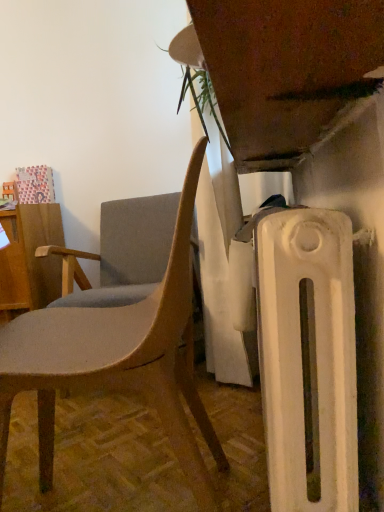
Question: Does matte gray chair at center, which is the 2th chair in back-to-front order, contain wooden desk at left?

Choices:
 (A) no
 (B) yes

Answer: (A)

Question: From the image's perspective, is matte gray chair at center, which is the 2th chair in back-to-front order, beneath wooden desk at left?

Choices:
 (A) yes
 (B) no

Answer: (A)

Question: Can you confirm if matte gray chair at center, which is the 2th chair in back-to-front order, is positioned to the left of wooden desk at left?

Choices:
 (A) yes
 (B) no

Answer: (B)

Question: Does matte gray chair at center, the first chair from the front, have a greater height compared to wooden desk at left?

Choices:
 (A) yes
 (B) no

Answer: (A)

Question: From a real-world perspective, is matte gray chair at center, the first chair from the front, physically below wooden desk at left?

Choices:
 (A) no
 (B) yes

Answer: (B)

Question: From a real-world perspective, is matte gray chair at center, the first chair from the front, over wooden desk at left?

Choices:
 (A) yes
 (B) no

Answer: (B)

Question: Does matte gray fabric chair at left, arranged as the first chair when viewed from the back, have a greater height compared to matte gray chair at center, the first chair from the front?

Choices:
 (A) no
 (B) yes

Answer: (A)

Question: From a real-world perspective, is matte gray fabric chair at left, positioned as the 2th chair in front-to-back order, physically above matte gray chair at center, which is the 2th chair in back-to-front order?

Choices:
 (A) yes
 (B) no

Answer: (A)

Question: Is matte gray fabric chair at left, positioned as the 2th chair in front-to-back order, far away from matte gray chair at center, the first chair from the front?

Choices:
 (A) no
 (B) yes

Answer: (A)

Question: Is matte gray fabric chair at left, arranged as the first chair when viewed from the back, at the left side of matte gray chair at center, which is the 2th chair in back-to-front order?

Choices:
 (A) yes
 (B) no

Answer: (A)

Question: From the image's perspective, is matte gray fabric chair at left, arranged as the first chair when viewed from the back, on matte gray chair at center, the first chair from the front?

Choices:
 (A) yes
 (B) no

Answer: (A)

Question: Is matte gray fabric chair at left, arranged as the first chair when viewed from the back, smaller than matte gray chair at center, the first chair from the front?

Choices:
 (A) no
 (B) yes

Answer: (A)

Question: Considering the relative sizes of matte gray chair at center, the first chair from the front, and matte gray fabric chair at left, arranged as the first chair when viewed from the back, in the image provided, is matte gray chair at center, the first chair from the front, wider than matte gray fabric chair at left, arranged as the first chair when viewed from the back,?

Choices:
 (A) yes
 (B) no

Answer: (B)